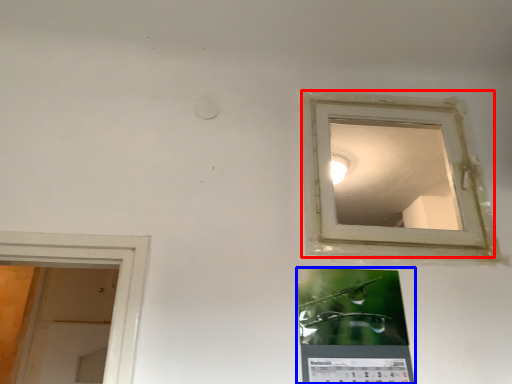
Question: Which object is further to the camera taking this photo, window (highlighted by a red box) or bulletin board (highlighted by a blue box)?

Choices:
 (A) window
 (B) bulletin board

Answer: (A)